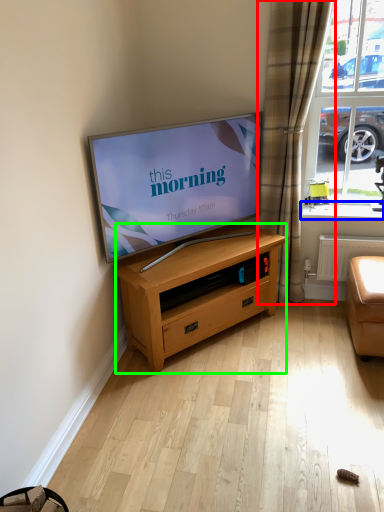
Question: Estimate the real-world distances between objects in this image. Which object is farther from curtain (highlighted by a red box), window sill (highlighted by a blue box) or chest of drawers (highlighted by a green box)?

Choices:
 (A) window sill
 (B) chest of drawers

Answer: (B)